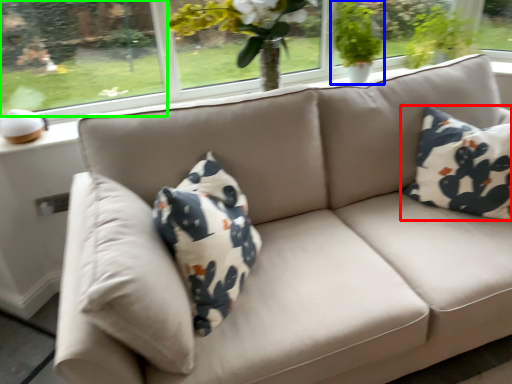
Question: Considering the real-world distances, which object is closest to pillow (highlighted by a red box)? houseplant (highlighted by a blue box) or window screen (highlighted by a green box).

Choices:
 (A) houseplant
 (B) window screen

Answer: (A)